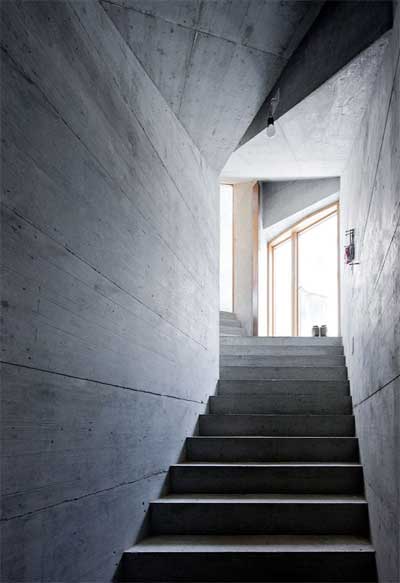
You are a GUI agent. You are given a task and a screenshot of the screen. Output one action in this format:
    pyautogui.click(x=<x>, y=<y>)
    Task: Click on the doorway
    The width and height of the screenshot is (400, 583).
    Given the screenshot: What is the action you would take?
    pyautogui.click(x=223, y=243)